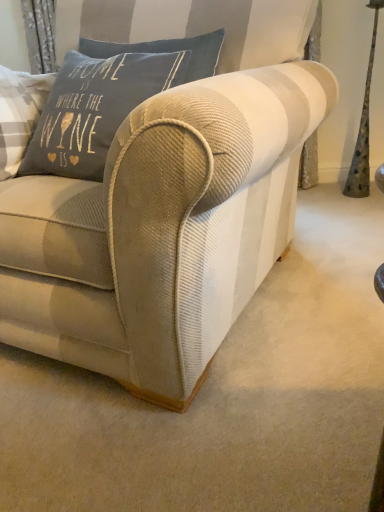
What is the approximate width of matte gray cushion at upper left?

The width of matte gray cushion at upper left is 8.68 inches.

Describe the element at coordinates (95, 109) in the screenshot. The image size is (384, 512). I see `matte gray cushion at upper left` at that location.

Where is `matte gray cushion at upper left`? The height and width of the screenshot is (512, 384). matte gray cushion at upper left is located at coordinates (95, 109).

At what (x,y) coordinates should I click in order to perform the action: click on beige corduroy couch at center. Please return your answer as a coordinate pair (x, y). Looking at the image, I should click on (168, 203).

Image resolution: width=384 pixels, height=512 pixels. What do you see at coordinates (168, 203) in the screenshot?
I see `beige corduroy couch at center` at bounding box center [168, 203].

Locate an element on the screen. This screenshot has width=384, height=512. matte gray cushion at upper left is located at coordinates (95, 109).

Considering the positions of objects beige corduroy couch at center and matte gray cushion at upper left in the image provided, who is more to the left, beige corduroy couch at center or matte gray cushion at upper left?

Positioned to the left is matte gray cushion at upper left.

Which object is further away from the camera, beige corduroy couch at center or matte gray cushion at upper left?

matte gray cushion at upper left.

Is point (272, 143) positioned behind point (122, 74)?

No, it is not.

From the image's perspective, which is below, beige corduroy couch at center or matte gray cushion at upper left?

beige corduroy couch at center.

From a real-world perspective, is beige corduroy couch at center physically above matte gray cushion at upper left?

Incorrect, from a real-world perspective, beige corduroy couch at center is lower than matte gray cushion at upper left.

Which object is wider, beige corduroy couch at center or matte gray cushion at upper left?

beige corduroy couch at center is wider.

Between beige corduroy couch at center and matte gray cushion at upper left, which one has more height?

With more height is beige corduroy couch at center.

Which of these two, beige corduroy couch at center or matte gray cushion at upper left, is smaller?

matte gray cushion at upper left.

Is beige corduroy couch at center not inside matte gray cushion at upper left?

That's correct, beige corduroy couch at center is outside of matte gray cushion at upper left.

Is beige corduroy couch at center not close to matte gray cushion at upper left?

No.

Is beige corduroy couch at center looking in the opposite direction of matte gray cushion at upper left?

Correct, beige corduroy couch at center is looking away from matte gray cushion at upper left.

What's the angular difference between beige corduroy couch at center and matte gray cushion at upper left's facing directions?

beige corduroy couch at center and matte gray cushion at upper left are facing 0.982 degrees away from each other.

Where is `studio couch below the matte gray cushion at upper left (from the image's perspective)`? studio couch below the matte gray cushion at upper left (from the image's perspective) is located at coordinates (168, 203).

Is matte gray cushion at upper left to the left of beige corduroy couch at center from the viewer's perspective?

Indeed, matte gray cushion at upper left is positioned on the left side of beige corduroy couch at center.

Is matte gray cushion at upper left positioned behind beige corduroy couch at center?

That is True.

Considering the positions of point (50, 156) and point (137, 117), is point (50, 156) closer or farther from the camera than point (137, 117)?

Point (50, 156) is positioned farther from the camera compared to point (137, 117).

From the image's perspective, is matte gray cushion at upper left located above or below beige corduroy couch at center?

matte gray cushion at upper left is above beige corduroy couch at center.

From a real-world perspective, is matte gray cushion at upper left on beige corduroy couch at center?

Indeed, from a real-world perspective, matte gray cushion at upper left stands above beige corduroy couch at center.

Between matte gray cushion at upper left and beige corduroy couch at center, which one has smaller width?

With smaller width is matte gray cushion at upper left.

Which of these two, matte gray cushion at upper left or beige corduroy couch at center, stands taller?

With more height is beige corduroy couch at center.

Which of these two, matte gray cushion at upper left or beige corduroy couch at center, is bigger?

beige corduroy couch at center is bigger.

In the scene shown: Would you say matte gray cushion at upper left contains beige corduroy couch at center?

Definitely not — beige corduroy couch at center is not inside matte gray cushion at upper left.

Would you consider matte gray cushion at upper left to be distant from beige corduroy couch at center?

No, there isn't a large distance between matte gray cushion at upper left and beige corduroy couch at center.

Could you tell me if matte gray cushion at upper left is turned towards beige corduroy couch at center?

Yes, matte gray cushion at upper left is oriented towards beige corduroy couch at center.

Locate an element on the screen. The height and width of the screenshot is (512, 384). pillow on the left of beige corduroy couch at center is located at coordinates (95, 109).

Locate an element on the screen. This screenshot has height=512, width=384. studio couch on the right of matte gray cushion at upper left is located at coordinates (168, 203).

In the image, there is a matte gray cushion at upper left. Find the location of `studio couch below it (from the image's perspective)`. studio couch below it (from the image's perspective) is located at coordinates (168, 203).